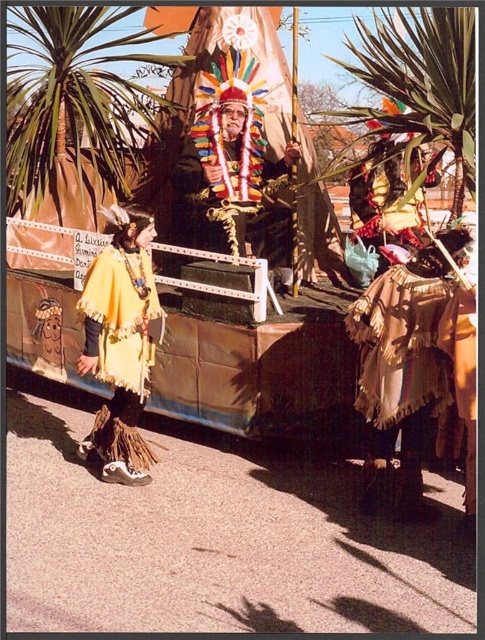
Is green leafy palm tree at upper right wider than multicolored feather headdress at center?

No.

Is green leafy palm tree at upper right positioned before multicolored feather headdress at center?

Yes, it is.

This screenshot has width=485, height=640. Describe the element at coordinates (421, 77) in the screenshot. I see `green leafy palm tree at upper right` at that location.

Identify the location of green leafy palm tree at upper right. (421, 77).

Which is more to the right, green leafy palm tree at upper left or yellow fringed cape at lower left?

Positioned to the right is yellow fringed cape at lower left.

Where is `green leafy palm tree at upper left`? The width and height of the screenshot is (485, 640). green leafy palm tree at upper left is located at coordinates (73, 97).

Where is `green leafy palm tree at upper left`? green leafy palm tree at upper left is located at coordinates pyautogui.click(x=73, y=97).

Is yellow fringed cape at lower left below multicolored feather headdress at center?

Correct, yellow fringed cape at lower left is located below multicolored feather headdress at center.

Which is in front, point (124, 289) or point (208, 148)?

Positioned in front is point (124, 289).

Find the location of a particular element. yellow fringed cape at lower left is located at coordinates (122, 344).